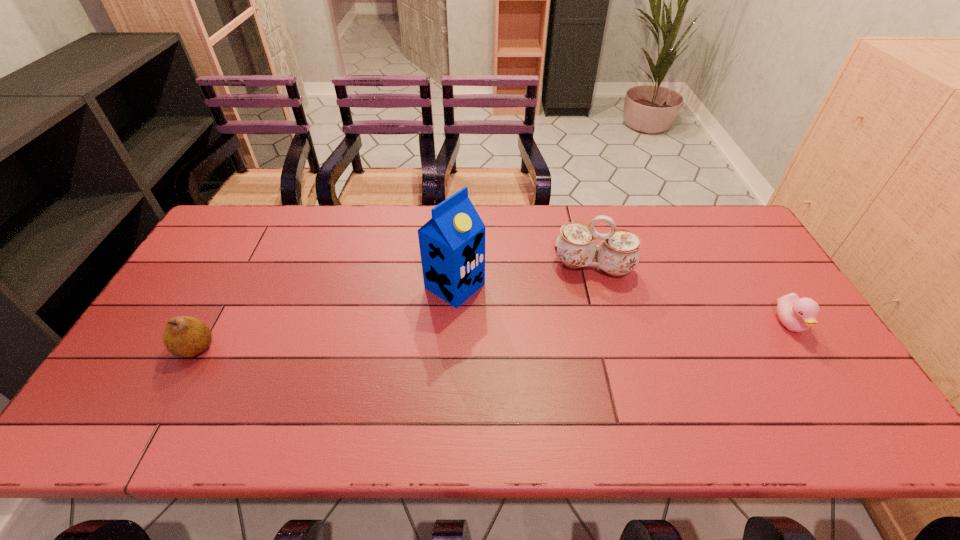
The width and height of the screenshot is (960, 540). I want to click on the leftmost object, so click(184, 336).

At what (x,y) coordinates should I click in order to perform the action: click on pear. Please return your answer as a coordinate pair (x, y). This screenshot has width=960, height=540. Looking at the image, I should click on (184, 336).

This screenshot has height=540, width=960. I want to click on duckling, so click(797, 314).

Locate an element on the screen. Image resolution: width=960 pixels, height=540 pixels. the rightmost object is located at coordinates (797, 314).

What are the coordinates of `the tallest object` in the screenshot? It's located at (452, 243).

I want to click on carton, so click(452, 243).

Where is `the third shortest object`? The image size is (960, 540). the third shortest object is located at coordinates (618, 254).

The height and width of the screenshot is (540, 960). I want to click on chinaware, so click(x=618, y=254).

The image size is (960, 540). Find the location of `vacant position located 0.160m on the right of the pear`. vacant position located 0.160m on the right of the pear is located at coordinates (277, 347).

Identify the location of vacant space located on the front-facing side of the duckling. (821, 372).